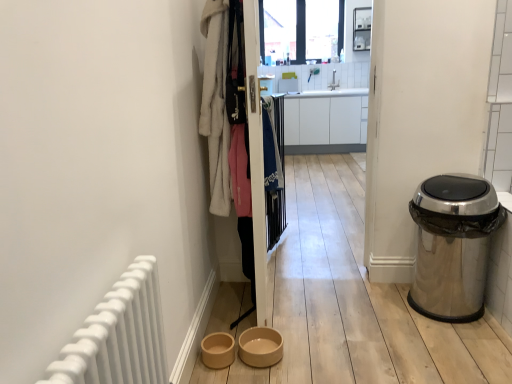
Question: Is white glossy cabinet at center positioned in front of brown matte bowl at lower center, arranged as the second toilet bowl when viewed from the right?

Choices:
 (A) no
 (B) yes

Answer: (A)

Question: Is white glossy cabinet at center wider than brown matte bowl at lower center, arranged as the second toilet bowl when viewed from the right?

Choices:
 (A) yes
 (B) no

Answer: (A)

Question: Is white glossy cabinet at center at the left side of brown matte bowl at lower center, arranged as the second toilet bowl when viewed from the right?

Choices:
 (A) no
 (B) yes

Answer: (A)

Question: From the image's perspective, is white glossy cabinet at center above brown matte bowl at lower center, the first toilet bowl in the left-to-right sequence?

Choices:
 (A) yes
 (B) no

Answer: (A)

Question: Can you confirm if white glossy cabinet at center is thinner than brown matte bowl at lower center, arranged as the second toilet bowl when viewed from the right?

Choices:
 (A) yes
 (B) no

Answer: (B)

Question: Is white glossy cabinet at center not within brown matte bowl at lower center, the first toilet bowl in the left-to-right sequence?

Choices:
 (A) yes
 (B) no

Answer: (A)

Question: Is white glossy cabinet at center taller than blue fabric at center, which is the 1th clothing from back to front?

Choices:
 (A) yes
 (B) no

Answer: (A)

Question: Can you confirm if white glossy cabinet at center is wider than blue fabric at center, which is the 2th clothing from front to back?

Choices:
 (A) no
 (B) yes

Answer: (B)

Question: Are white glossy cabinet at center and blue fabric at center, the first clothing positioned from the right, beside each other?

Choices:
 (A) no
 (B) yes

Answer: (A)

Question: Is white glossy cabinet at center outside of blue fabric at center, which is the 1th clothing from back to front?

Choices:
 (A) yes
 (B) no

Answer: (A)

Question: Is white glossy cabinet at center positioned behind blue fabric at center, which is the 1th clothing from back to front?

Choices:
 (A) no
 (B) yes

Answer: (B)

Question: Is white glossy cabinet at center positioned with its back to blue fabric at center, which is the 2th clothing from front to back?

Choices:
 (A) yes
 (B) no

Answer: (B)

Question: From the image's perspective, does beige ceramic bowl at lower center, which is the second toilet bowl from left to right, appear higher than transparent glass window at upper center?

Choices:
 (A) no
 (B) yes

Answer: (A)